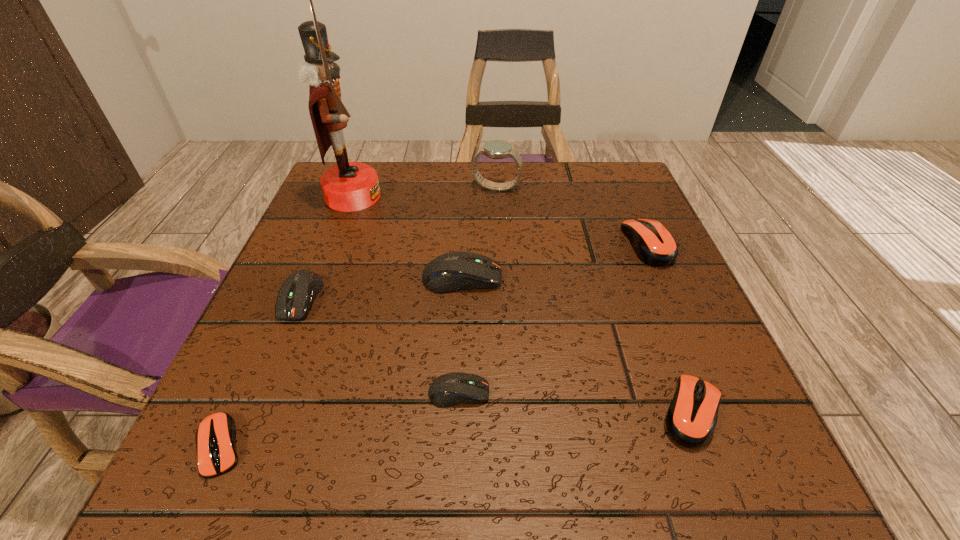
Where is `free area in between the biggest dark computer equipment and the nearest dark computer equipment`? free area in between the biggest dark computer equipment and the nearest dark computer equipment is located at coordinates (461, 335).

Find the location of `free space between the leftmost dark computer equipment and the nearest dark computer equipment`. free space between the leftmost dark computer equipment and the nearest dark computer equipment is located at coordinates (380, 346).

The width and height of the screenshot is (960, 540). I want to click on the second closest object to the shortest computer mouse, so 451,389.

This screenshot has height=540, width=960. I want to click on object that is the sixth closest to the second smallest orange computer mouse, so click(215, 437).

Identify which computer mouse is the fourth closest to the nutcracker. Please provide its 2D coordinates. Your answer should be formatted as a tuple, i.e. [(x, y)], where the tuple contains the x and y coordinates of a point satisfying the conditions above.

[(215, 437)]

Choose which computer mouse is the fifth nearest neighbor to the red nutcracker. Please provide its 2D coordinates. Your answer should be formatted as a tuple, i.e. [(x, y)], where the tuple contains the x and y coordinates of a point satisfying the conditions above.

[(652, 242)]

Identify which dark computer equipment is located as the third nearest to the blue watch. Please provide its 2D coordinates. Your answer should be formatted as a tuple, i.e. [(x, y)], where the tuple contains the x and y coordinates of a point satisfying the conditions above.

[(451, 389)]

Locate an element on the screen. The width and height of the screenshot is (960, 540). dark computer equipment object that ranks as the closest to the shortest object is located at coordinates (298, 291).

Identify which orange computer mouse is the second closest to the leftmost orange computer mouse. Please provide its 2D coordinates. Your answer should be formatted as a tuple, i.e. [(x, y)], where the tuple contains the x and y coordinates of a point satisfying the conditions above.

[(652, 242)]

Find the location of a particular element. This screenshot has width=960, height=540. orange computer mouse that is the third closest to the third tallest object is located at coordinates (215, 437).